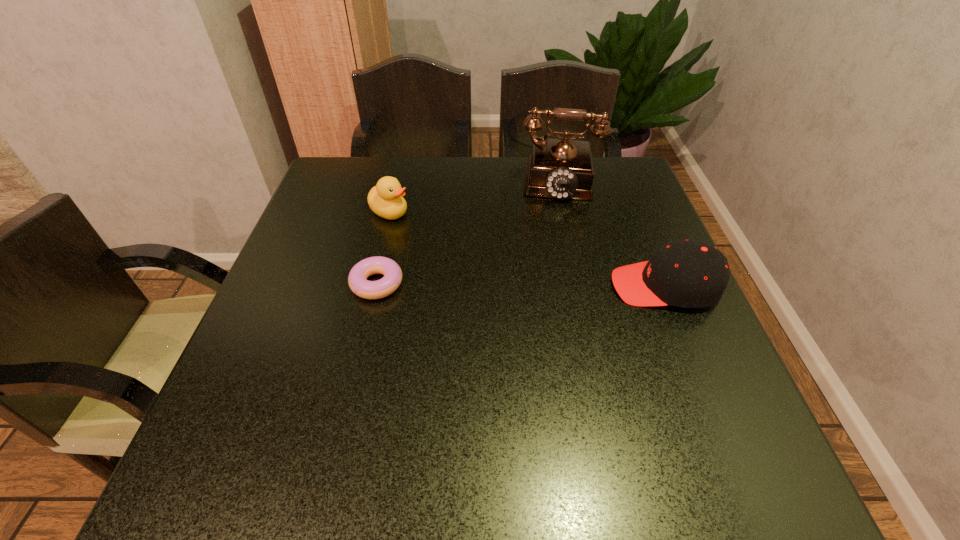
At what (x,y) coordinates should I click in order to perform the action: click on free space between the duckling and the telephone. Please return your answer as a coordinate pair (x, y). Looking at the image, I should click on (471, 195).

Where is `free space between the telephone and the duckling`? free space between the telephone and the duckling is located at coordinates (471, 195).

At what (x,y) coordinates should I click in order to perform the action: click on unoccupied area between the cap and the tallest object. Please return your answer as a coordinate pair (x, y). The height and width of the screenshot is (540, 960). Looking at the image, I should click on (609, 232).

Where is `vacant space in between the cap and the duckling`? vacant space in between the cap and the duckling is located at coordinates (527, 249).

The height and width of the screenshot is (540, 960). Identify the location of free space between the telephone and the doughnut. (465, 231).

Where is `object that is the third closest to the duckling`? This screenshot has height=540, width=960. object that is the third closest to the duckling is located at coordinates (689, 274).

Select which object appears as the third closest to the cap. Please provide its 2D coordinates. Your answer should be formatted as a tuple, i.e. [(x, y)], where the tuple contains the x and y coordinates of a point satisfying the conditions above.

[(385, 199)]

This screenshot has height=540, width=960. Identify the location of free location that satisfies the following two spatial constraints: 1. on the front side of the duckling; 2. on the right side of the doughnut. (372, 284).

The width and height of the screenshot is (960, 540). I want to click on free space that satisfies the following two spatial constraints: 1. on the front side of the duckling; 2. on the front-facing side of the cap, so click(x=372, y=286).

The height and width of the screenshot is (540, 960). Find the location of `vacant area in the image that satisfies the following two spatial constraints: 1. on the back side of the tallest object; 2. on the right side of the shortest object`. vacant area in the image that satisfies the following two spatial constraints: 1. on the back side of the tallest object; 2. on the right side of the shortest object is located at coordinates (401, 178).